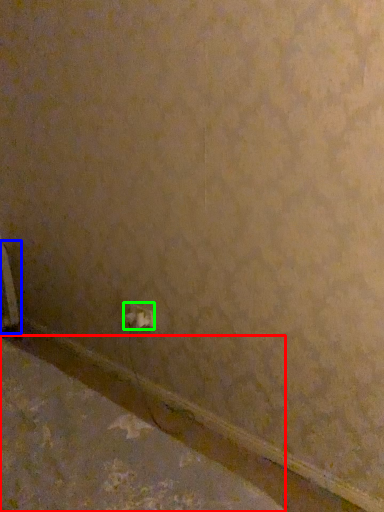
Question: Based on their relative distances, which object is nearer to concrete (highlighted by a red box)? Choose from radiator (highlighted by a blue box) and power plugs and sockets (highlighted by a green box).

Choices:
 (A) radiator
 (B) power plugs and sockets

Answer: (B)